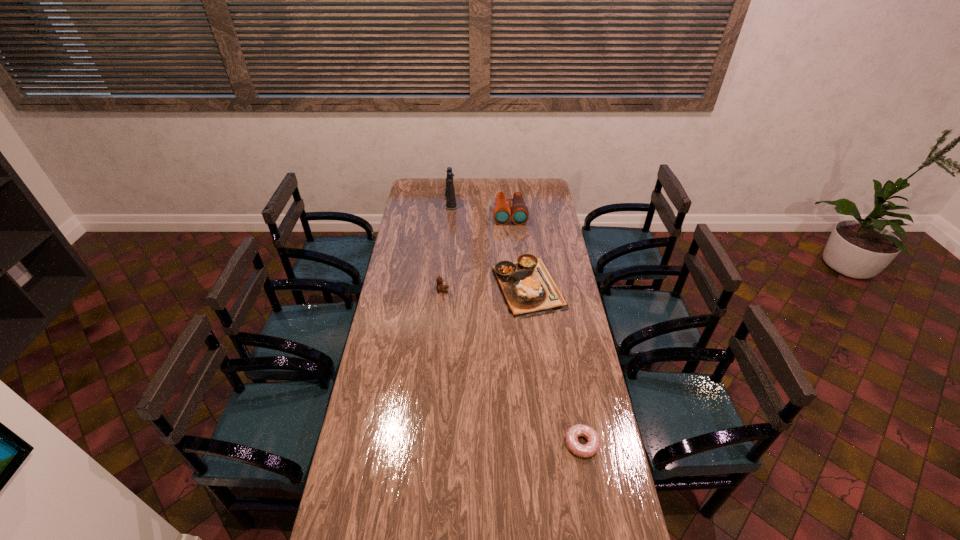
Image resolution: width=960 pixels, height=540 pixels. I want to click on vacant space located 0.300m at the face of the teddy bear, so click(513, 290).

I want to click on vacant space located on the front of the platter, so click(x=539, y=379).

At what (x,y) coordinates should I click in order to perform the action: click on free spot located on the front of the nearest object. Please return your answer as a coordinate pair (x, y). This screenshot has width=960, height=540. Looking at the image, I should click on (596, 523).

The image size is (960, 540). What are the coordinates of `object at the far edge` in the screenshot? It's located at click(450, 190).

At what (x,y) coordinates should I click in order to perform the action: click on platter that is at the right edge. Please return your answer as a coordinate pair (x, y). The width and height of the screenshot is (960, 540). Looking at the image, I should click on (528, 289).

Where is `doughnut that is at the right edge`? doughnut that is at the right edge is located at coordinates (579, 430).

Where is `vacant region at the far edge`? vacant region at the far edge is located at coordinates (474, 198).

Image resolution: width=960 pixels, height=540 pixels. What are the coordinates of `vacant space at the left edge` in the screenshot? It's located at (386, 345).

Where is `vacant area at the right edge`? vacant area at the right edge is located at coordinates (589, 367).

Image resolution: width=960 pixels, height=540 pixels. I want to click on empty space between the second shortest object and the left binoculars, so click(x=489, y=245).